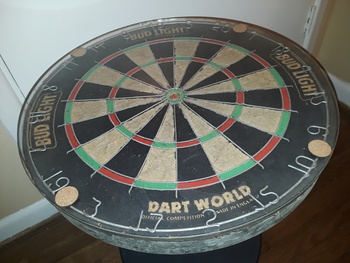
You are a GUI agent. You are given a task and a screenshot of the screen. Output one action in this format:
    pyautogui.click(x=<x>, y=<y>)
    Task: Click on the floor
    
    Given the screenshot: What is the action you would take?
    pyautogui.click(x=317, y=238), pyautogui.click(x=45, y=249)